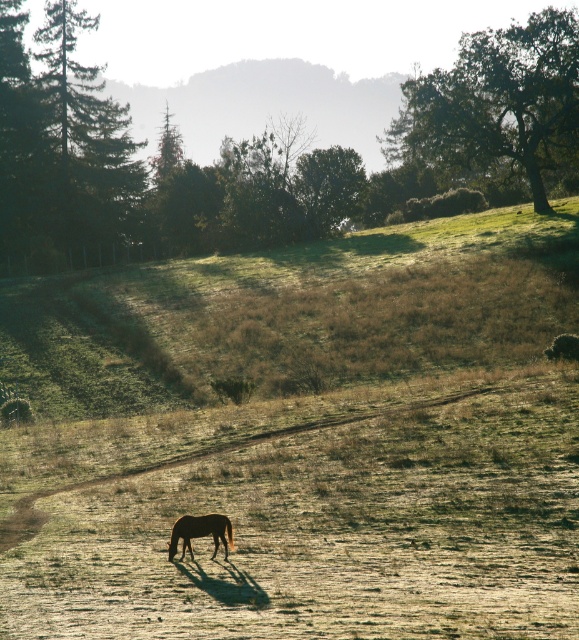
Question: Does green leafy tree at upper right appear over brown glossy horse at center?

Choices:
 (A) yes
 (B) no

Answer: (A)

Question: Among these points, which one is farthest from the camera?

Choices:
 (A) (185, 516)
 (B) (540, 106)

Answer: (B)

Question: Does green leafy tree at upper right have a greater width compared to brown glossy horse at center?

Choices:
 (A) yes
 (B) no

Answer: (A)

Question: Which point is closer to the camera?

Choices:
 (A) (193, 536)
 (B) (515, 96)

Answer: (A)

Question: Is green leafy tree at upper right smaller than brown glossy horse at center?

Choices:
 (A) yes
 (B) no

Answer: (B)

Question: Which point is farther to the camera?

Choices:
 (A) (229, 524)
 (B) (507, 148)

Answer: (B)